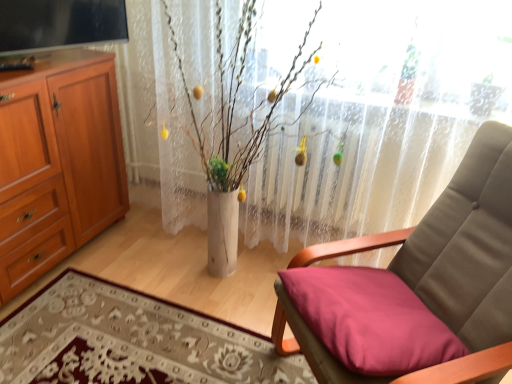
Question: Can you confirm if matte pink cushion at lower right is thinner than smooth fabric cushion at lower right?

Choices:
 (A) no
 (B) yes

Answer: (B)

Question: From a real-world perspective, is matte pink cushion at lower right under smooth fabric cushion at lower right?

Choices:
 (A) yes
 (B) no

Answer: (B)

Question: Considering the relative sizes of matte pink cushion at lower right and smooth fabric cushion at lower right in the image provided, is matte pink cushion at lower right bigger than smooth fabric cushion at lower right?

Choices:
 (A) yes
 (B) no

Answer: (A)

Question: Is matte pink cushion at lower right shorter than smooth fabric cushion at lower right?

Choices:
 (A) yes
 (B) no

Answer: (B)

Question: From the image's perspective, is matte pink cushion at lower right on top of smooth fabric cushion at lower right?

Choices:
 (A) no
 (B) yes

Answer: (B)

Question: Considering the relative sizes of matte pink cushion at lower right and smooth fabric cushion at lower right in the image provided, is matte pink cushion at lower right wider than smooth fabric cushion at lower right?

Choices:
 (A) no
 (B) yes

Answer: (A)

Question: Can you confirm if white sheer curtain at center is smaller than smooth fabric cushion at lower right?

Choices:
 (A) no
 (B) yes

Answer: (A)

Question: Is white sheer curtain at center thinner than smooth fabric cushion at lower right?

Choices:
 (A) no
 (B) yes

Answer: (B)

Question: Considering the relative positions of white sheer curtain at center and smooth fabric cushion at lower right in the image provided, is white sheer curtain at center to the right of smooth fabric cushion at lower right from the viewer's perspective?

Choices:
 (A) yes
 (B) no

Answer: (A)

Question: From a real-world perspective, is white sheer curtain at center below smooth fabric cushion at lower right?

Choices:
 (A) no
 (B) yes

Answer: (A)

Question: Is white sheer curtain at center not near smooth fabric cushion at lower right?

Choices:
 (A) no
 (B) yes

Answer: (A)

Question: Is white sheer curtain at center bigger than smooth fabric cushion at lower right?

Choices:
 (A) yes
 (B) no

Answer: (A)

Question: From a real-world perspective, is white sheer curtain at center positioned over wooden cabinet at left based on gravity?

Choices:
 (A) no
 (B) yes

Answer: (B)